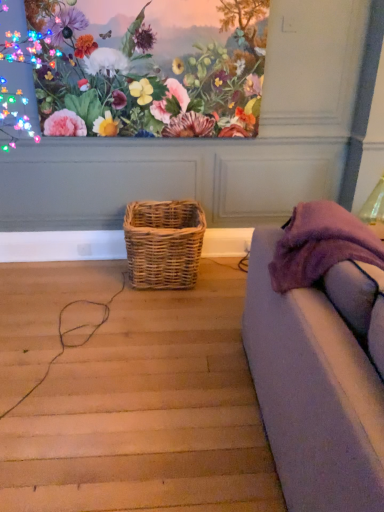
The width and height of the screenshot is (384, 512). What do you see at coordinates (163, 243) in the screenshot?
I see `woven natural basket at center` at bounding box center [163, 243].

Measure the distance between point (341, 490) and camera.

Point (341, 490) and camera are 3.38 feet apart from each other.

At what (x,y) coordinates should I click in order to perform the action: click on woven natural basket at center. Please return your answer as a coordinate pair (x, y). Looking at the image, I should click on (163, 243).

Considering the relative sizes of matte floral painting at upper center and purple fabric couch at right in the image provided, is matte floral painting at upper center smaller than purple fabric couch at right?

Correct, matte floral painting at upper center occupies less space than purple fabric couch at right.

Is matte floral painting at upper center next to purple fabric couch at right and touching it?

No, matte floral painting at upper center is not with purple fabric couch at right.

Is matte floral painting at upper center facing away from purple fabric couch at right?

matte floral painting at upper center does not have its back to purple fabric couch at right.

Is purple fabric couch at right closer to camera compared to woven natural basket at center?

Yes, purple fabric couch at right is closer to the viewer.

From a real-world perspective, is purple fabric couch at right located higher than woven natural basket at center?

Yes, from a real-world perspective, purple fabric couch at right is on top of woven natural basket at center.

Is purple fabric couch at right far away from woven natural basket at center?

purple fabric couch at right is positioned a significant distance from woven natural basket at center.

In the scene shown: How far apart are purple fabric couch at right and woven natural basket at center?

1.06 meters.

Where is `picnic basket below the purple fabric couch at right (from a real-world perspective)`? This screenshot has width=384, height=512. picnic basket below the purple fabric couch at right (from a real-world perspective) is located at coordinates (163, 243).

Between woven natural basket at center and purple fabric couch at right, which one appears on the left side from the viewer's perspective?

woven natural basket at center is more to the left.

From the image's perspective, between woven natural basket at center and purple fabric couch at right, who is located below?

purple fabric couch at right, from the image's perspective.

How different are the orientations of woven natural basket at center and purple fabric couch at right in degrees?

They differ by 0.311 degrees in their facing directions.

From the image's perspective, which is above, woven natural basket at center or matte floral painting at upper center?

From the image's view, matte floral painting at upper center is above.

Considering the relative sizes of woven natural basket at center and matte floral painting at upper center in the image provided, is woven natural basket at center thinner than matte floral painting at upper center?

Incorrect, the width of woven natural basket at center is not less than that of matte floral painting at upper center.

The height and width of the screenshot is (512, 384). Identify the location of picnic basket directly beneath the matte floral painting at upper center (from a real-world perspective). (163, 243).

Between woven natural basket at center and matte floral painting at upper center, which one is positioned in front?

matte floral painting at upper center.

Based on the photo, how different are the orientations of matte floral painting at upper center and woven natural basket at center in degrees?

88.6 degrees.

Can you confirm if matte floral painting at upper center is positioned to the right of woven natural basket at center?

Incorrect, matte floral painting at upper center is not on the right side of woven natural basket at center.

From the image's perspective, is matte floral painting at upper center located beneath woven natural basket at center?

No, from the image's perspective, matte floral painting at upper center is not below woven natural basket at center.

From a real-world perspective, is matte floral painting at upper center positioned above or below woven natural basket at center?

Clearly, from a real-world perspective, matte floral painting at upper center is above woven natural basket at center.

Between purple fabric couch at right and matte floral painting at upper center, which one has larger width?

With larger width is purple fabric couch at right.

From a real-world perspective, is purple fabric couch at right physically located above or below matte floral painting at upper center?

purple fabric couch at right is below matte floral painting at upper center.

This screenshot has height=512, width=384. In order to click on studio couch located below the matte floral painting at upper center (from the image's perspective) in this screenshot , I will do `click(313, 393)`.

Between purple fabric couch at right and matte floral painting at upper center, which one appears on the left side from the viewer's perspective?

From the viewer's perspective, matte floral painting at upper center appears more on the left side.

The image size is (384, 512). Identify the location of studio couch that is on the right side of matte floral painting at upper center. (313, 393).

Identify the location of studio couch in front of the woven natural basket at center. (313, 393).

Looking at this image, estimate the real-world distances between objects in this image. Which object is closer to purple fabric couch at right, woven natural basket at center or matte floral painting at upper center?

woven natural basket at center is closer to purple fabric couch at right.

When comparing their distances from woven natural basket at center, does matte floral painting at upper center or purple fabric couch at right seem further?

Based on the image, purple fabric couch at right appears to be further to woven natural basket at center.

Looking at the image, which one is located closer to woven natural basket at center, purple fabric couch at right or matte floral painting at upper center?

Result: Based on the image, matte floral painting at upper center appears to be nearer to woven natural basket at center.

Estimate the real-world distances between objects in this image. Which object is closer to matte floral painting at upper center, purple fabric couch at right or woven natural basket at center?

Based on the image, woven natural basket at center appears to be nearer to matte floral painting at upper center.

Estimate the real-world distances between objects in this image. Which object is closer to matte floral painting at upper center, woven natural basket at center or purple fabric couch at right?

woven natural basket at center lies closer to matte floral painting at upper center than the other object.

Which object lies further to the anchor point purple fabric couch at right, matte floral painting at upper center or woven natural basket at center?

Among the two, matte floral painting at upper center is located further to purple fabric couch at right.

The image size is (384, 512). Identify the location of flower between purple fabric couch at right and woven natural basket at center in the front-back direction. (131, 72).